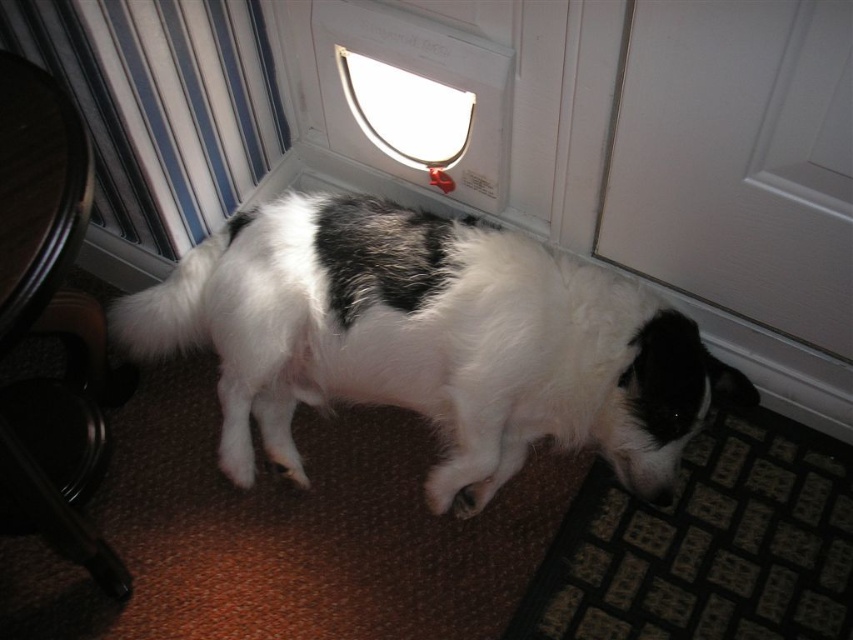
You are a delivery robot entering the room and need to avoid the white fluffy dog at center. Where should you move to stay clear of the dog?

The white fluffy dog at center is located at coordinates approximately 0.534 on the x axis and 0.504 on the y axis. To avoid it, move to an area with coordinates outside this position, such as near the edges or corners of the room.

You are a delivery robot entering a house and need to avoid the white fluffy dog at center. The robot has a height of 1.2 meters. The dog is 1.09 meters away from the camera. Can the robot safely navigate around the dog without hitting it?

The white fluffy dog at center is 1.09 meters away from the camera. Since the robot is 1.2 meters tall, it can safely navigate around the dog as the distance allows enough space to avoid collision.

You are a delivery robot with a width of 12 inches. You need to pass through the space between the white fluffy dog at center and the white matte door at lower right. Can you fit through the gap?

The white fluffy dog at center and white matte door at lower right are 13.08 inches apart, so yes, the robot can fit through the gap since its width of 12 inches is less than the 13.08 inches available.